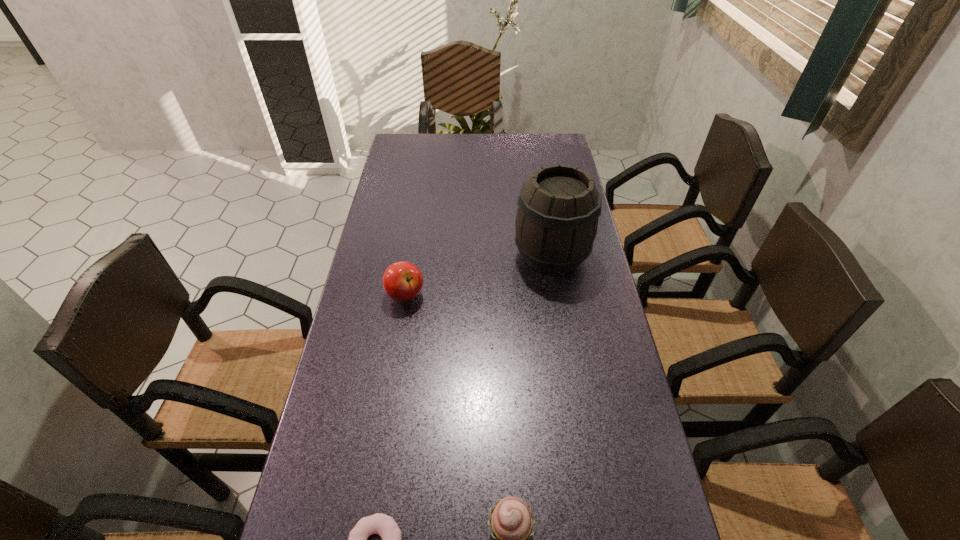
Where is `wine bucket`? wine bucket is located at coordinates (556, 223).

The width and height of the screenshot is (960, 540). In order to click on apple in this screenshot , I will do `click(402, 281)`.

Image resolution: width=960 pixels, height=540 pixels. I want to click on vacant space located on the left of the wine bucket, so click(x=471, y=255).

Locate an element on the screen. vacant space located on the back of the apple is located at coordinates (419, 213).

I want to click on object present at the left edge, so click(x=402, y=281).

Identify the location of object located at the right edge. The image size is (960, 540). (556, 223).

Where is `vacant region at the far edge of the desktop`? vacant region at the far edge of the desktop is located at coordinates (482, 157).

This screenshot has width=960, height=540. In the image, there is a desktop. Find the location of `vacant region at the left edge`. vacant region at the left edge is located at coordinates (422, 189).

This screenshot has height=540, width=960. I want to click on free location at the right edge, so click(583, 288).

This screenshot has width=960, height=540. Find the location of `vacant point at the far left corner`. vacant point at the far left corner is located at coordinates (426, 136).